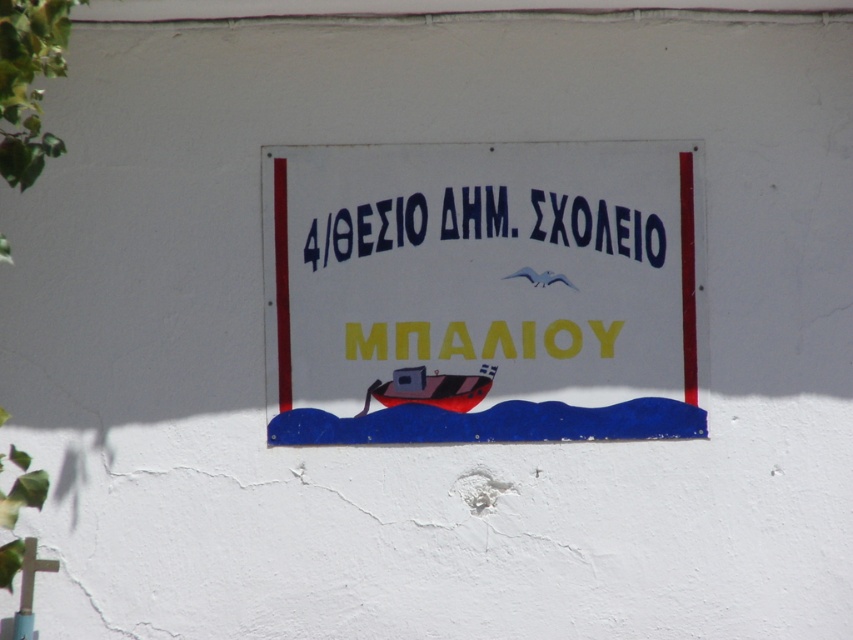
Question: Can you confirm if white plastic signboard at center is bigger than red matte boat at center?

Choices:
 (A) no
 (B) yes

Answer: (B)

Question: Which point appears farthest from the camera in this image?

Choices:
 (A) pyautogui.click(x=450, y=385)
 (B) pyautogui.click(x=532, y=212)
 (C) pyautogui.click(x=486, y=172)

Answer: (C)

Question: Which point is closer to the camera?

Choices:
 (A) pyautogui.click(x=299, y=184)
 (B) pyautogui.click(x=480, y=202)
 (C) pyautogui.click(x=428, y=387)

Answer: (C)

Question: Can you confirm if black painted text at center is smaller than red matte boat at center?

Choices:
 (A) yes
 (B) no

Answer: (B)

Question: Considering the relative positions of black painted text at center and red matte boat at center in the image provided, where is black painted text at center located with respect to red matte boat at center?

Choices:
 (A) above
 (B) below

Answer: (A)

Question: Which point is farther from the camera taking this photo?

Choices:
 (A) (693, 234)
 (B) (381, 384)
 (C) (407, 205)

Answer: (A)